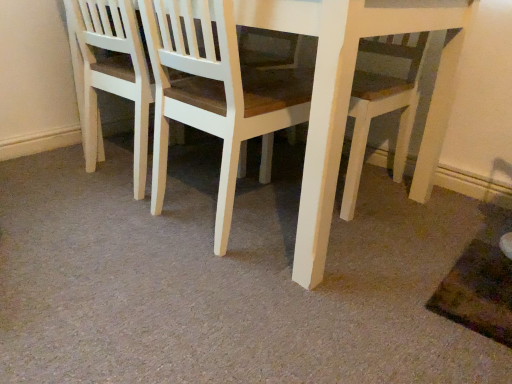
Question: Considering the relative sizes of white wood chair at center, the 2th chair in the right-to-left sequence, and white wood chair at center, marked as the second chair in a left-to-right arrangement, in the image provided, is white wood chair at center, the 2th chair in the right-to-left sequence, wider than white wood chair at center, marked as the second chair in a left-to-right arrangement,?

Choices:
 (A) yes
 (B) no

Answer: (B)

Question: Is white wood chair at center, arranged as the 1th chair when viewed from the left, to the left of white wood chair at center, marked as the second chair in a left-to-right arrangement, from the viewer's perspective?

Choices:
 (A) yes
 (B) no

Answer: (A)

Question: Is white wood chair at center, arranged as the 1th chair when viewed from the left, thinner than white wood chair at center, marked as the second chair in a left-to-right arrangement?

Choices:
 (A) no
 (B) yes

Answer: (B)

Question: Is white wood chair at center, arranged as the 1th chair when viewed from the left, oriented away from white wood chair at center, acting as the first chair starting from the right?

Choices:
 (A) yes
 (B) no

Answer: (B)

Question: From the image's perspective, is white wood chair at center, the 2th chair in the right-to-left sequence, on white wood chair at center, marked as the second chair in a left-to-right arrangement?

Choices:
 (A) yes
 (B) no

Answer: (A)

Question: Is white wood chair at center, arranged as the 1th chair when viewed from the left, behind white wood chair at center, marked as the second chair in a left-to-right arrangement?

Choices:
 (A) yes
 (B) no

Answer: (A)

Question: Can you confirm if white wood chair at center, acting as the first chair starting from the right, is taller than white wood chair at center, the 2th chair in the right-to-left sequence?

Choices:
 (A) yes
 (B) no

Answer: (A)

Question: Is white wood chair at center, marked as the second chair in a left-to-right arrangement, smaller than white wood chair at center, arranged as the 1th chair when viewed from the left?

Choices:
 (A) no
 (B) yes

Answer: (A)

Question: Is white wood chair at center, marked as the second chair in a left-to-right arrangement, at the left side of white wood chair at center, arranged as the 1th chair when viewed from the left?

Choices:
 (A) yes
 (B) no

Answer: (B)

Question: Does white wood chair at center, marked as the second chair in a left-to-right arrangement, have a greater width compared to white wood chair at center, arranged as the 1th chair when viewed from the left?

Choices:
 (A) yes
 (B) no

Answer: (A)

Question: Considering the relative sizes of white wood chair at center, acting as the first chair starting from the right, and white wood chair at center, the 2th chair in the right-to-left sequence, in the image provided, is white wood chair at center, acting as the first chair starting from the right, bigger than white wood chair at center, the 2th chair in the right-to-left sequence,?

Choices:
 (A) yes
 (B) no

Answer: (A)

Question: From the image's perspective, is white wood chair at center, acting as the first chair starting from the right, under white wood chair at center, arranged as the 1th chair when viewed from the left?

Choices:
 (A) no
 (B) yes

Answer: (B)

Question: Choose the correct answer: Is white wood chair at center, marked as the second chair in a left-to-right arrangement, inside white wood chair at center, arranged as the 1th chair when viewed from the left, or outside it?

Choices:
 (A) outside
 (B) inside

Answer: (A)